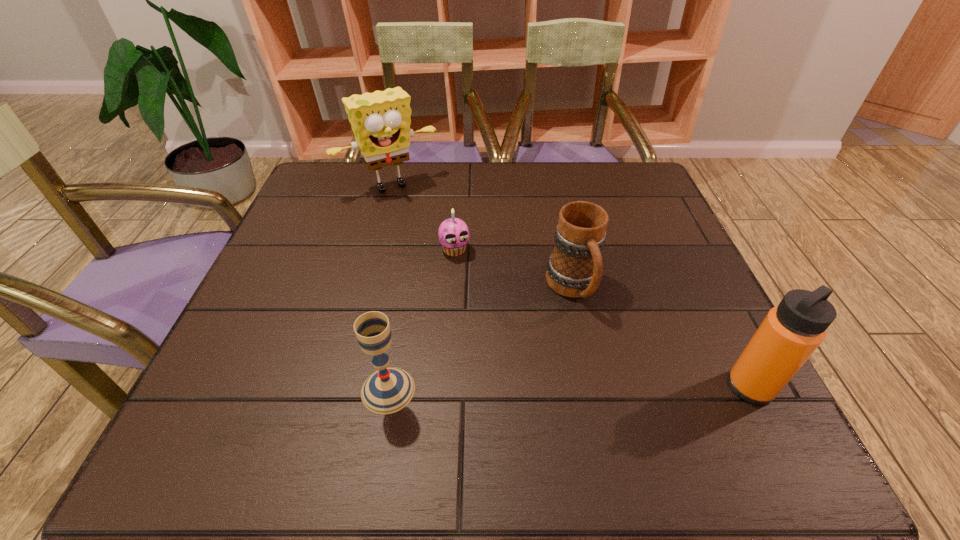
Where is `thermos bottle located in the near edge section of the desktop`? This screenshot has width=960, height=540. thermos bottle located in the near edge section of the desktop is located at coordinates (789, 334).

At what (x,y) coordinates should I click in order to perform the action: click on object located at the left edge. Please return your answer as a coordinate pair (x, y). Looking at the image, I should click on [381, 120].

This screenshot has height=540, width=960. I want to click on object present at the right edge, so click(789, 334).

The image size is (960, 540). Find the location of `object that is positioned at the far left corner`. object that is positioned at the far left corner is located at coordinates (381, 120).

This screenshot has height=540, width=960. Find the location of `object located at the near right corner`. object located at the near right corner is located at coordinates (789, 334).

Identify the location of free space at the far edge. The image size is (960, 540). (508, 203).

In the image, there is a desktop. Identify the location of vacant space at the near edge. The image size is (960, 540). (497, 387).

The image size is (960, 540). I want to click on blank area at the left edge, so click(317, 257).

Locate an element on the screen. This screenshot has width=960, height=540. vacant space at the right edge is located at coordinates (615, 230).

Where is `vacant space at the far left corner of the desktop`? The image size is (960, 540). vacant space at the far left corner of the desktop is located at coordinates (334, 208).